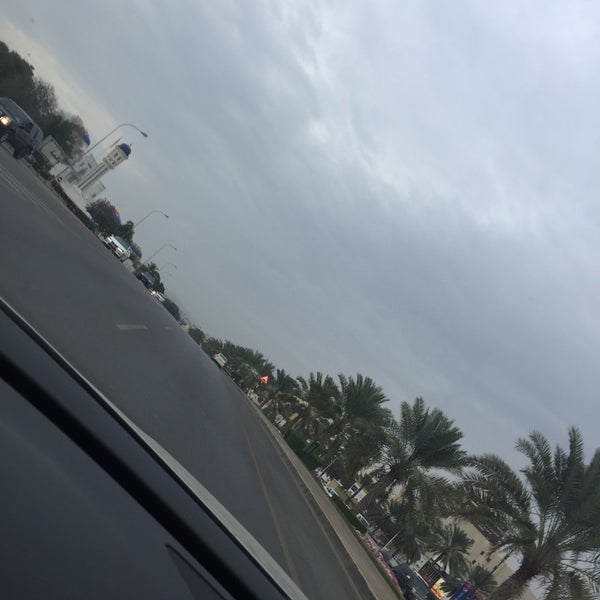
Image resolution: width=600 pixels, height=600 pixels. What are the coordinates of `hood` in the screenshot? It's located at (233, 524).